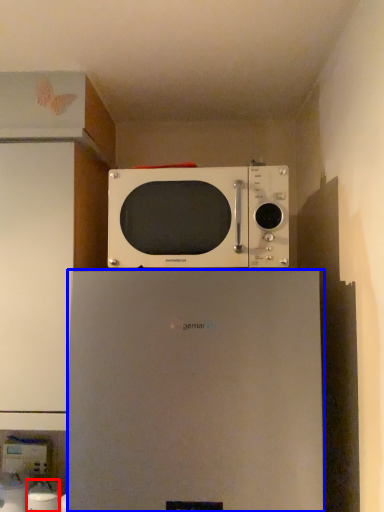
Question: Which object appears closest to the camera in this image, appliance (highlighted by a red box) or refrigerator (highlighted by a blue box)?

Choices:
 (A) appliance
 (B) refrigerator

Answer: (B)